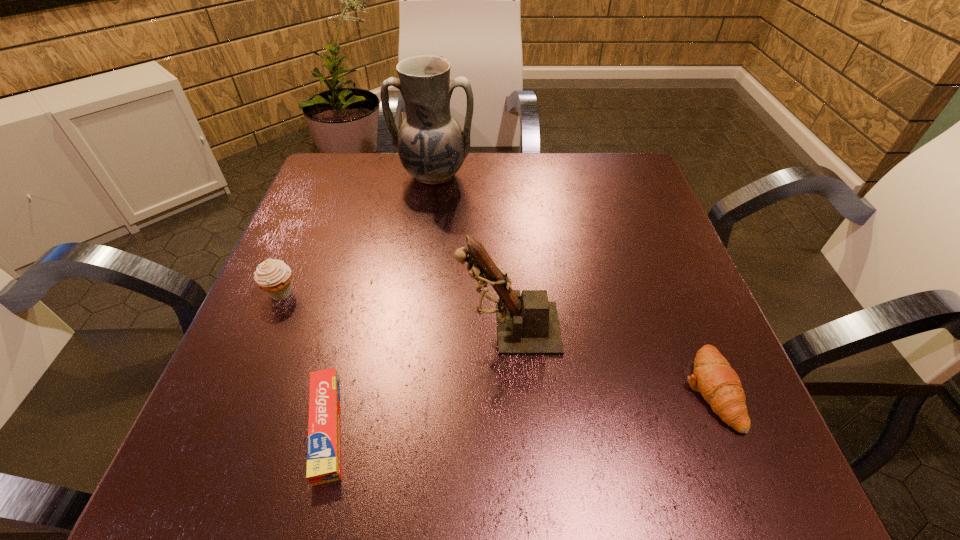
Identify the location of free space between the toothpaste and the muffin. This screenshot has height=540, width=960. (304, 360).

Where is `free space between the muffin and the pitcher`? The image size is (960, 540). free space between the muffin and the pitcher is located at coordinates (357, 234).

Image resolution: width=960 pixels, height=540 pixels. What are the coordinates of `unoccupied area between the leftmost object and the shortest object` in the screenshot? It's located at pos(304,360).

Locate an element on the screen. The width and height of the screenshot is (960, 540). free area in between the pitcher and the toothpaste is located at coordinates (380, 301).

This screenshot has width=960, height=540. Identify the location of empty location between the muffin and the second tallest object. (395, 310).

This screenshot has height=540, width=960. What are the coordinates of `unoccupied position between the shortest object and the third shortest object` in the screenshot? It's located at (304, 360).

You are a GUI agent. You are given a task and a screenshot of the screen. Output one action in this format:
    pyautogui.click(x=<x>, y=<y>)
    Task: Click on the free space between the farthest object and the crescent roll
    The height and width of the screenshot is (540, 960).
    Given the screenshot: What is the action you would take?
    pyautogui.click(x=571, y=282)

Identify the location of vacant point located between the toothpaste and the leftmost object. The height and width of the screenshot is (540, 960). [x=304, y=360].

Select which object appears as the third closest to the leftmost object. Please provide its 2D coordinates. Your answer should be formatted as a tuple, i.e. [(x, y)], where the tuple contains the x and y coordinates of a point satisfying the conditions above.

[(432, 147)]

What are the coordinates of `the second closest object relative to the rightmost object` in the screenshot? It's located at (323, 451).